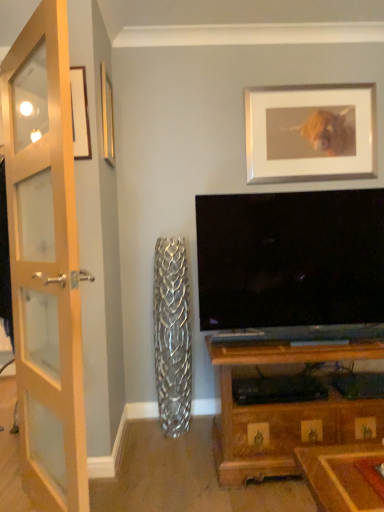
In order to face silver/metallic picture frame at upper center, the first picture frame when ordered from right to left, should I rotate leftwards or rightwards?

It's best to rotate right around 15.808 degrees.

You are a GUI agent. You are given a task and a screenshot of the screen. Output one action in this format:
    pyautogui.click(x=<x>, y=<y>)
    Task: Click on the wooden picture frame at upper left, placed as the second picture frame when sorted from right to left
    The width and height of the screenshot is (384, 512).
    Given the screenshot: What is the action you would take?
    click(x=107, y=117)

What do you see at coordinates (45, 262) in the screenshot? I see `wooden glass door at left` at bounding box center [45, 262].

Find the location of a particular element. The height and width of the screenshot is (512, 384). silver/metallic picture frame at upper center, the first picture frame when ordered from right to left is located at coordinates (310, 132).

Is silver/metallic picture frame at upper center, the 2th picture frame viewed from the front, looking in the opposite direction of wooden picture frame at upper left, the 1th picture frame from the front?

No, silver/metallic picture frame at upper center, the 2th picture frame viewed from the front,'s orientation is not away from wooden picture frame at upper left, the 1th picture frame from the front.

How many degrees apart are the facing directions of silver/metallic picture frame at upper center, the 2th picture frame in the left-to-right sequence, and wooden picture frame at upper left, placed as the second picture frame when sorted from right to left?

The angular difference between silver/metallic picture frame at upper center, the 2th picture frame in the left-to-right sequence, and wooden picture frame at upper left, placed as the second picture frame when sorted from right to left, is 89.9 degrees.

Considering the sizes of objects silver/metallic picture frame at upper center, the 2th picture frame in the left-to-right sequence, and wooden picture frame at upper left, the 1th picture frame from the front, in the image provided, who is shorter, silver/metallic picture frame at upper center, the 2th picture frame in the left-to-right sequence, or wooden picture frame at upper left, the 1th picture frame from the front,?

wooden picture frame at upper left, the 1th picture frame from the front, is shorter.

From the image's perspective, is silver/metallic picture frame at upper center, which ranks as the first picture frame in back-to-front order, above wooden picture frame at upper left, which ranks as the first picture frame in left-to-right order?

Yes, from the image's perspective, silver/metallic picture frame at upper center, which ranks as the first picture frame in back-to-front order, is on top of wooden picture frame at upper left, which ranks as the first picture frame in left-to-right order.

Can you confirm if silver/metallic picture frame at upper center, the 2th picture frame viewed from the front, is wider than wooden glass door at left?

No.

Who is taller, silver/metallic picture frame at upper center, the 2th picture frame in the left-to-right sequence, or wooden glass door at left?

With more height is wooden glass door at left.

Which point is more distant from viewer, (360, 121) or (46, 184)?

Point (360, 121)

From a real-world perspective, between silver/metallic picture frame at upper center, the 2th picture frame in the left-to-right sequence, and wooden glass door at left, who is vertically higher?

In real-world perspective, silver/metallic picture frame at upper center, the 2th picture frame in the left-to-right sequence, is above.

Is point (111, 112) in front of point (46, 476)?

No, (111, 112) is further to viewer.

Which is more to the left, wooden picture frame at upper left, the 1th picture frame from the front, or wooden glass door at left?

Positioned to the left is wooden glass door at left.

Is wooden picture frame at upper left, the second picture frame when ordered from back to front, not within wooden glass door at left?

Absolutely, wooden picture frame at upper left, the second picture frame when ordered from back to front, is external to wooden glass door at left.

Between wooden picture frame at upper left, the second picture frame when ordered from back to front, and wooden glass door at left, which one has more height?

wooden glass door at left.

How much distance is there between wooden glass door at left and wooden picture frame at upper left, placed as the second picture frame when sorted from right to left?

wooden glass door at left is 31.30 inches from wooden picture frame at upper left, placed as the second picture frame when sorted from right to left.

Considering the relative sizes of wooden glass door at left and wooden picture frame at upper left, the 1th picture frame from the front, in the image provided, is wooden glass door at left smaller than wooden picture frame at upper left, the 1th picture frame from the front,?

No, wooden glass door at left is not smaller than wooden picture frame at upper left, the 1th picture frame from the front.

Considering the relative positions of wooden glass door at left and wooden picture frame at upper left, which ranks as the first picture frame in left-to-right order, in the image provided, is wooden glass door at left to the right of wooden picture frame at upper left, which ranks as the first picture frame in left-to-right order, from the viewer's perspective?

No.

Can you tell me how much wooden glass door at left and wooden picture frame at upper left, the second picture frame when ordered from back to front, differ in facing direction?

wooden glass door at left and wooden picture frame at upper left, the second picture frame when ordered from back to front, are facing 145 degrees away from each other.

From a real-world perspective, is wooden glass door at left below silver/metallic picture frame at upper center, the first picture frame when ordered from right to left?

Indeed, from a real-world perspective, wooden glass door at left is positioned beneath silver/metallic picture frame at upper center, the first picture frame when ordered from right to left.

Considering the relative sizes of wooden glass door at left and silver/metallic picture frame at upper center, which ranks as the first picture frame in back-to-front order, in the image provided, is wooden glass door at left shorter than silver/metallic picture frame at upper center, which ranks as the first picture frame in back-to-front order,?

Incorrect, the height of wooden glass door at left does not fall short of that of silver/metallic picture frame at upper center, which ranks as the first picture frame in back-to-front order.

From the image's perspective, between wooden glass door at left and silver/metallic picture frame at upper center, the 2th picture frame viewed from the front, who is located below?

wooden glass door at left is shown below in the image.

Locate an element on the screen. The image size is (384, 512). the 2nd picture frame behind the wooden glass door at left is located at coordinates (310, 132).

From the image's perspective, would you say wooden picture frame at upper left, the second picture frame when ordered from back to front, is shown under silver/metallic picture frame at upper center, the 2th picture frame viewed from the front?

Yes.

Would you consider wooden picture frame at upper left, the second picture frame when ordered from back to front, to be distant from silver/metallic picture frame at upper center, the first picture frame when ordered from right to left?

Absolutely, wooden picture frame at upper left, the second picture frame when ordered from back to front, is distant from silver/metallic picture frame at upper center, the first picture frame when ordered from right to left.

Can you tell me how much wooden picture frame at upper left, placed as the second picture frame when sorted from right to left, and silver/metallic picture frame at upper center, the first picture frame when ordered from right to left, differ in facing direction?

wooden picture frame at upper left, placed as the second picture frame when sorted from right to left, and silver/metallic picture frame at upper center, the first picture frame when ordered from right to left, are facing 89.9 degrees away from each other.

At what (x,y) coordinates should I click in order to perform the action: click on picture frame above the wooden picture frame at upper left, placed as the second picture frame when sorted from right to left (from the image's perspective). Please return your answer as a coordinate pair (x, y). Looking at the image, I should click on (310, 132).

Image resolution: width=384 pixels, height=512 pixels. Identify the location of door that is below the silver/metallic picture frame at upper center, which ranks as the first picture frame in back-to-front order (from the image's perspective). (45, 262).

Estimate the real-world distances between objects in this image. Which object is closer to wooden glass door at left, wooden picture frame at upper left, the 1th picture frame from the front, or silver/metallic picture frame at upper center, the 2th picture frame viewed from the front?

wooden picture frame at upper left, the 1th picture frame from the front, is closer to wooden glass door at left.

Consider the image. Looking at the image, which one is located further to silver/metallic picture frame at upper center, the first picture frame when ordered from right to left, wooden picture frame at upper left, the second picture frame when ordered from back to front, or wooden glass door at left?

Among the two, wooden glass door at left is located further to silver/metallic picture frame at upper center, the first picture frame when ordered from right to left.

From the image, which object appears to be farther from wooden picture frame at upper left, the 1th picture frame from the front, wooden glass door at left or silver/metallic picture frame at upper center, the 2th picture frame in the left-to-right sequence?

The object further to wooden picture frame at upper left, the 1th picture frame from the front, is silver/metallic picture frame at upper center, the 2th picture frame in the left-to-right sequence.

Considering their positions, is silver/metallic picture frame at upper center, which ranks as the first picture frame in back-to-front order, positioned further to wooden glass door at left than wooden picture frame at upper left, the 1th picture frame from the front?

Among the two, silver/metallic picture frame at upper center, which ranks as the first picture frame in back-to-front order, is located further to wooden glass door at left.

Looking at the image, which one is located further to wooden picture frame at upper left, the second picture frame when ordered from back to front, silver/metallic picture frame at upper center, the 2th picture frame viewed from the front, or wooden glass door at left?

The object further to wooden picture frame at upper left, the second picture frame when ordered from back to front, is silver/metallic picture frame at upper center, the 2th picture frame viewed from the front.

Looking at the image, which one is located further to silver/metallic picture frame at upper center, the first picture frame when ordered from right to left, wooden glass door at left or wooden picture frame at upper left, the second picture frame when ordered from back to front?

wooden glass door at left.

You are a GUI agent. You are given a task and a screenshot of the screen. Output one action in this format:
    pyautogui.click(x=<x>, y=<y>)
    Task: Click on the picture frame between wooden glass door at left and silver/metallic picture frame at upper center, which ranks as the first picture frame in back-to-front order
    This screenshot has height=512, width=384.
    Given the screenshot: What is the action you would take?
    pyautogui.click(x=107, y=117)